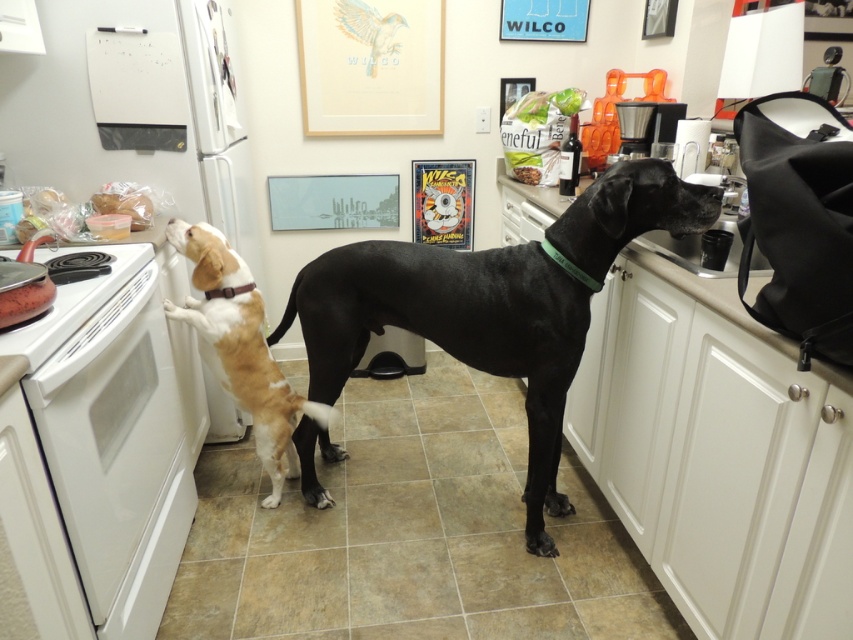
Is white glossy countertop at right to the right of black plastic coffee maker at upper right from the viewer's perspective?

Incorrect, white glossy countertop at right is not on the right side of black plastic coffee maker at upper right.

Describe the element at coordinates (711, 296) in the screenshot. Image resolution: width=853 pixels, height=640 pixels. I see `white glossy countertop at right` at that location.

Find the location of `white glossy countertop at right`. white glossy countertop at right is located at coordinates (711, 296).

You are a GUI agent. You are given a task and a screenshot of the screen. Output one action in this format:
    pyautogui.click(x=<x>, y=<y>)
    Task: Click on the black smooth coat dog at center
    
    Given the screenshot: What is the action you would take?
    pyautogui.click(x=454, y=332)

Can you confirm if black smooth coat dog at center is shorter than light brown fur at left?

Incorrect, black smooth coat dog at center's height does not fall short of light brown fur at left's.

The width and height of the screenshot is (853, 640). What do you see at coordinates (454, 332) in the screenshot? I see `black smooth coat dog at center` at bounding box center [454, 332].

Where is `black smooth coat dog at center`? The width and height of the screenshot is (853, 640). black smooth coat dog at center is located at coordinates (454, 332).

Does light brown fur at left lie in front of black plastic coffee maker at upper right?

Yes, it is in front of black plastic coffee maker at upper right.

Which is more to the left, light brown fur at left or black plastic coffee maker at upper right?

light brown fur at left is more to the left.

Between point (331, 417) and point (625, 122), which one is positioned behind?

The point (331, 417) is behind.

At what (x,y) coordinates should I click in order to perform the action: click on light brown fur at left. Please return your answer as a coordinate pair (x, y). Looking at the image, I should click on (241, 348).